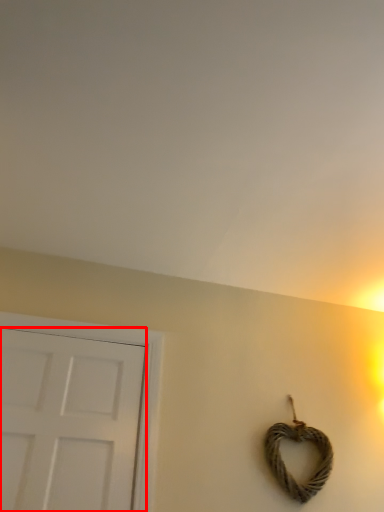
Question: Where is door (annotated by the red box) located in relation to rope in the image?

Choices:
 (A) left
 (B) right

Answer: (A)